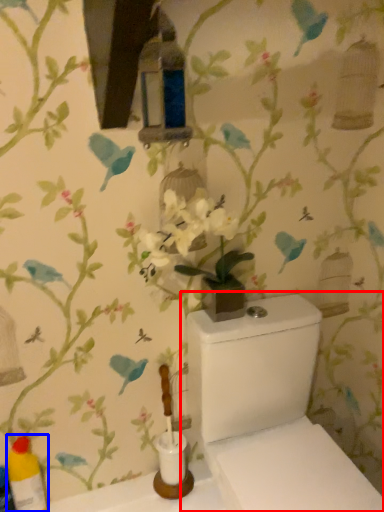
Question: Which object appears farthest to the camera in this image, toilet (highlighted by a red box) or bottle (highlighted by a blue box)?

Choices:
 (A) toilet
 (B) bottle

Answer: (B)